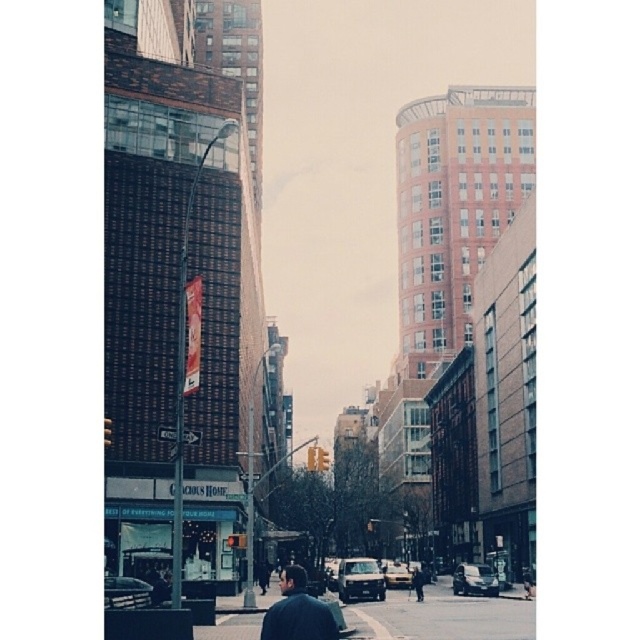
You are a delivery person standing on the smooth asphalt road at center. You need to hand a package to someone wearing the dark blue jacket at center. Can you reach them without moving from your current position?

The smooth asphalt road at center is not as tall as dark blue jacket at center, so yes, you can reach them without moving because the dark blue jacket at center is taller than the road.

You are standing at the intersection and want to walk towards the two points marked in the image. Which point, point (490, 618) or point (284, 586), is closer to you?

Point (490, 618) is closer to you because it is further to the viewer than point (284, 586).